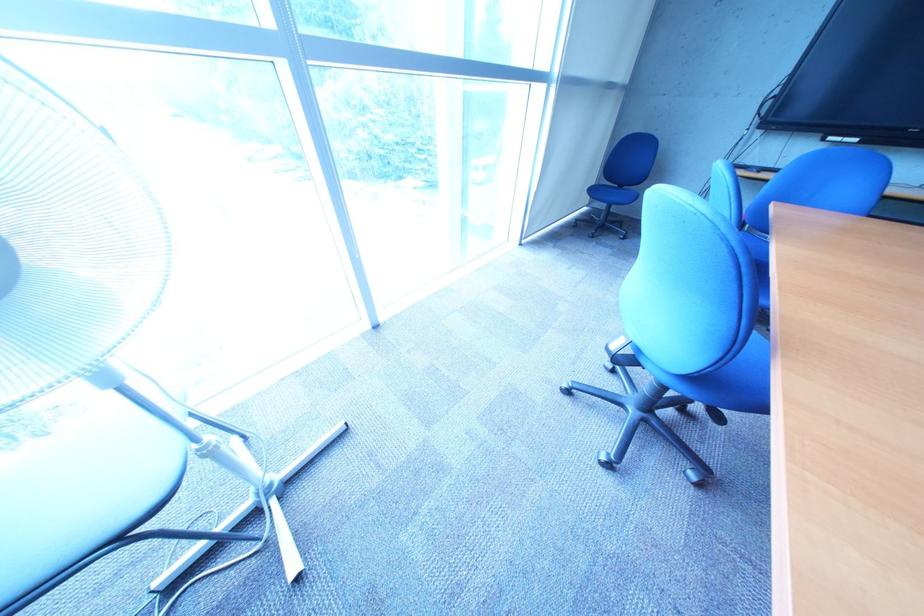
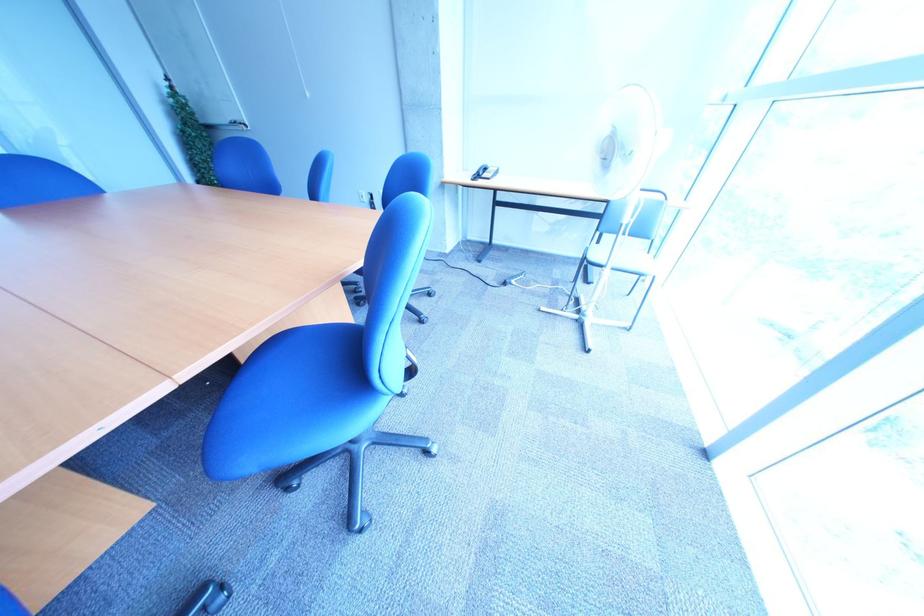
Where in the second image is the point corresponding to point (314, 581) from the first image?

(554, 312)